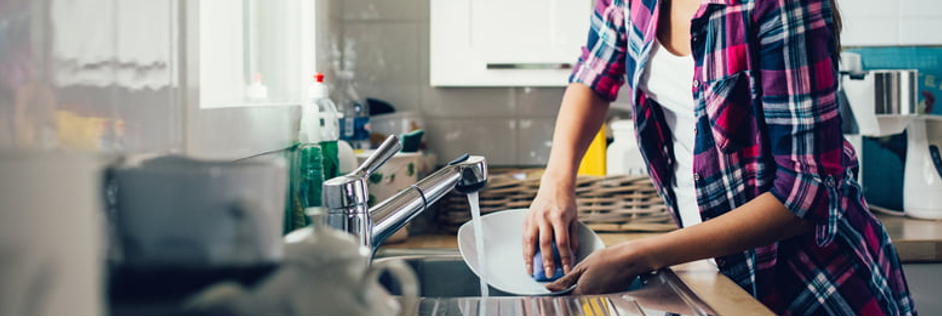
In order to click on kitchen tiled walls in this screenshot , I will do `click(380, 60)`, `click(152, 76)`.